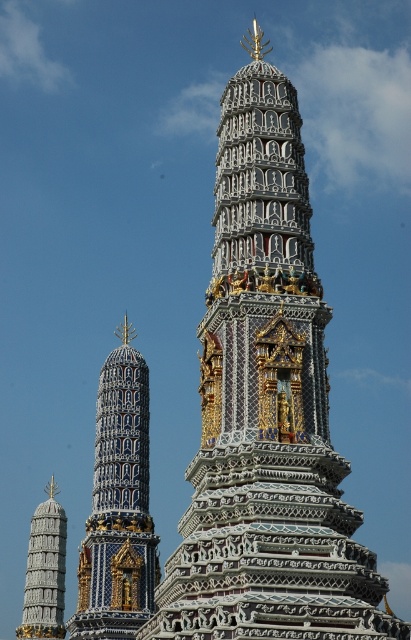
You are standing in front of the temple complex and want to take a photo. You notice two points marked on the structure. The first point is at coordinates point (182,604) and the second is at point (156,561). Which point is closer to you when you take the photo?

Point (182,604) is closer to the camera than point (156,561), so it will appear closer to you in the photo.

In the scene shown: You are an architect visiting the temple complex. You need to compare the size of the white glossy temple at center and the blue glazed tiles at left for a design report. Which one is larger?

The white glossy temple at center is bigger than the blue glazed tiles at left according to the description.